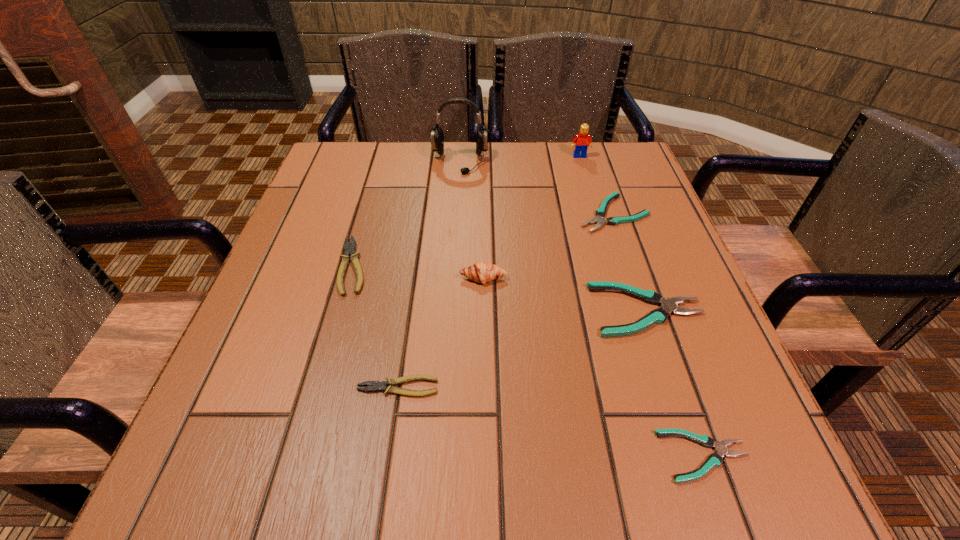
Locate an element on the screen. This screenshot has width=960, height=540. free point located on the left of the nearest pliers is located at coordinates (576, 456).

Where is `headset that is positioned at the far edge`? Image resolution: width=960 pixels, height=540 pixels. headset that is positioned at the far edge is located at coordinates (437, 135).

Find the location of a particular element. Lego present at the far edge is located at coordinates (581, 142).

In order to click on object that is at the near edge in this screenshot , I will do `click(714, 460)`.

Where is `object present at the left edge`? The image size is (960, 540). object present at the left edge is located at coordinates (349, 250).

Image resolution: width=960 pixels, height=540 pixels. I want to click on Lego situated at the right edge, so click(581, 142).

Find the location of a particular element. object that is positioned at the far right corner is located at coordinates (581, 142).

You are a GUI agent. You are given a task and a screenshot of the screen. Output one action in this format:
    pyautogui.click(x=<x>, y=<y>)
    Task: Click on the object situated at the near right corner
    
    Given the screenshot: What is the action you would take?
    pyautogui.click(x=714, y=460)

Where is `vacant space at the far edge`? This screenshot has width=960, height=540. vacant space at the far edge is located at coordinates (539, 167).

Find the location of `vacant point at the near edge`. vacant point at the near edge is located at coordinates (546, 476).